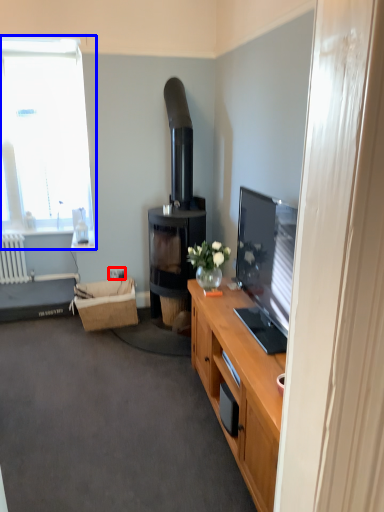
Question: Which object is further to the camera taking this photo, power outlet (highlighted by a red box) or window (highlighted by a blue box)?

Choices:
 (A) power outlet
 (B) window

Answer: (B)